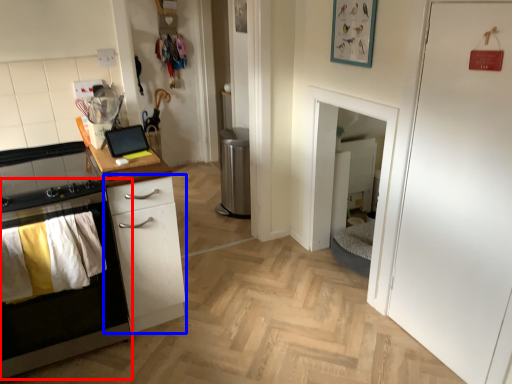
Question: Which of the following is the farthest to the observer, cabinetry (highlighted by a red box) or chest of drawers (highlighted by a blue box)?

Choices:
 (A) cabinetry
 (B) chest of drawers

Answer: (B)